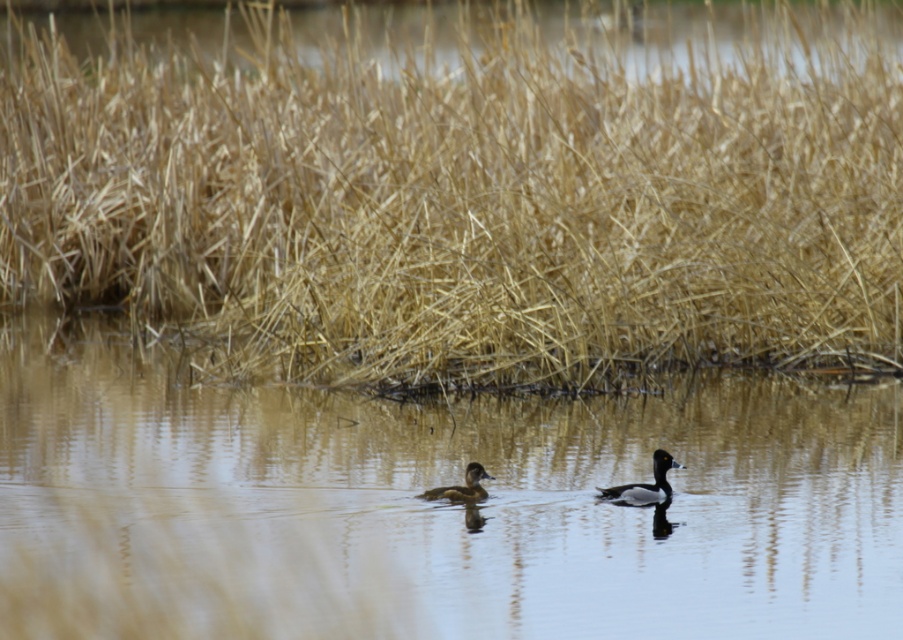
Question: Can you confirm if brown dry grass at upper center is wider than brown glossy duck at center?

Choices:
 (A) yes
 (B) no

Answer: (A)

Question: Observing the image, what is the correct spatial positioning of brown dry grass at upper center in reference to brown speckled duck at center?

Choices:
 (A) left
 (B) right

Answer: (A)

Question: Considering the real-world distances, which object is closest to the brown speckled duck at center?

Choices:
 (A) clear water at center
 (B) brown glossy duck at center
 (C) brown dry grass at upper center

Answer: (B)

Question: Which point is closer to the camera?

Choices:
 (A) brown glossy duck at center
 (B) brown speckled duck at center

Answer: (A)

Question: Which point is closer to the camera taking this photo?

Choices:
 (A) (573, 566)
 (B) (430, 492)
 (C) (631, 483)
 (D) (306, 256)

Answer: (A)

Question: Does brown dry grass at upper center have a smaller size compared to brown glossy duck at center?

Choices:
 (A) yes
 (B) no

Answer: (B)